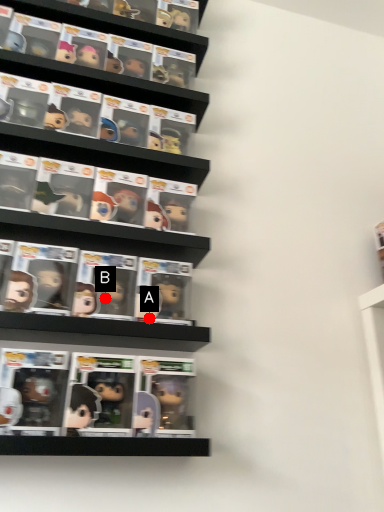
Question: Two points are circled on the image, labeled by A and B beside each circle. Which point is closer to the camera?

Choices:
 (A) A is closer
 (B) B is closer

Answer: (A)